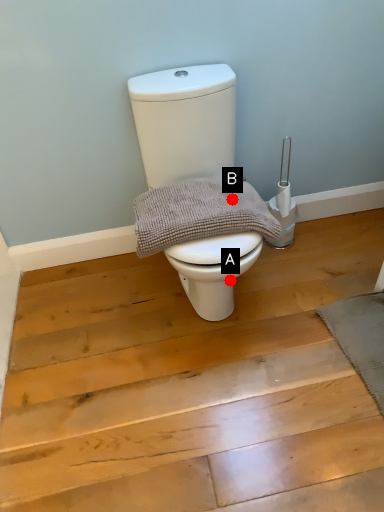
Question: Two points are circled on the image, labeled by A and B beside each circle. Which point is closer to the camera taking this photo?

Choices:
 (A) A is closer
 (B) B is closer

Answer: (B)